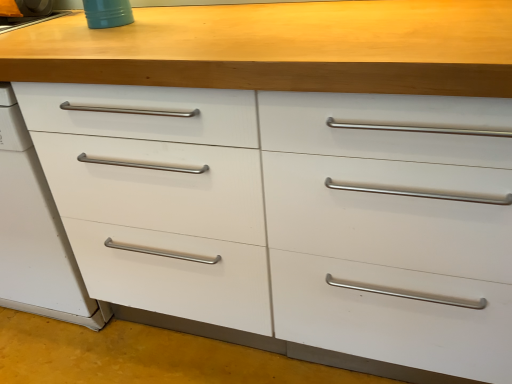
What is the approximate width of white matte cabinet at left?

It is 23.98 inches.

The image size is (512, 384). Identify the location of white matte cabinet at left. (158, 195).

Image resolution: width=512 pixels, height=384 pixels. Describe the element at coordinates (158, 195) in the screenshot. I see `white matte cabinet at left` at that location.

Where is `white matte cabinet at left`? The image size is (512, 384). white matte cabinet at left is located at coordinates (158, 195).